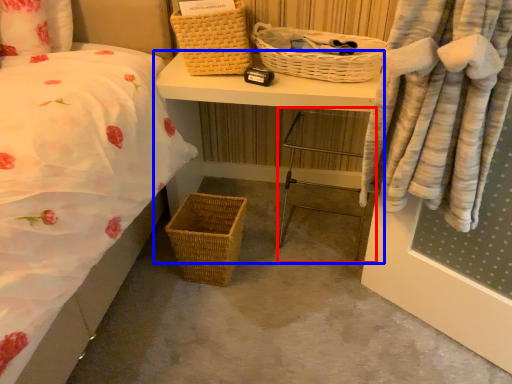
Question: Which object appears farthest to the camera in this image, chair (highlighted by a red box) or desk (highlighted by a blue box)?

Choices:
 (A) chair
 (B) desk

Answer: (B)